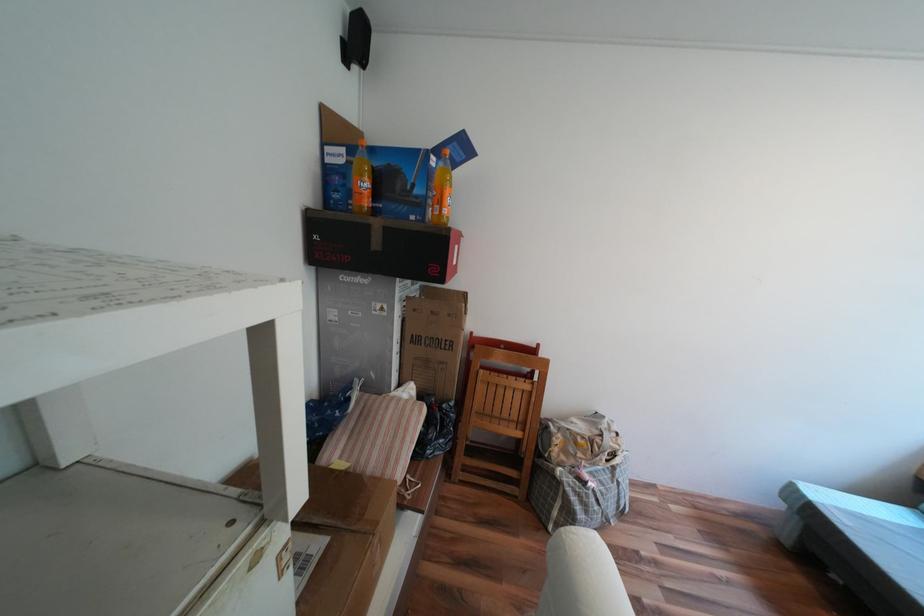
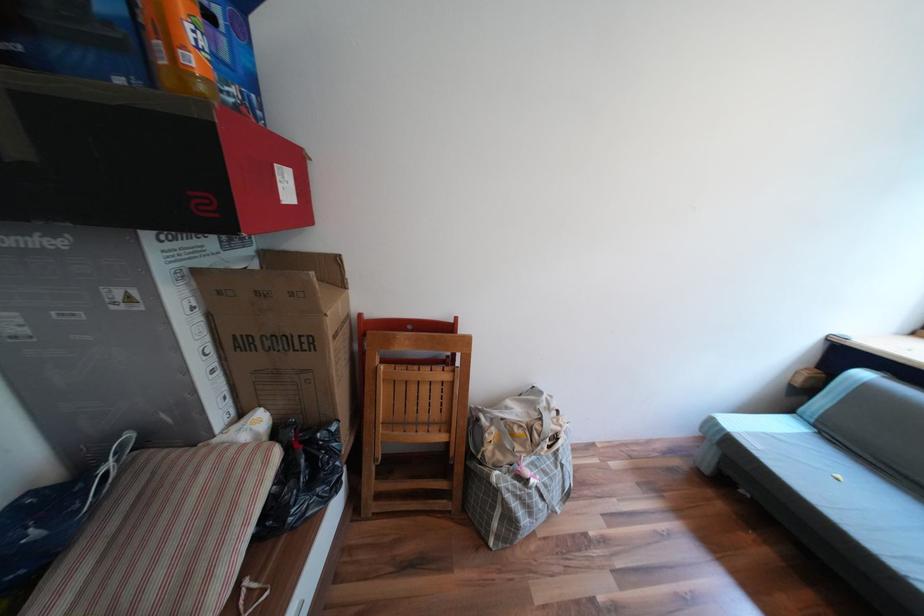
In the second image, find the point that corresponds to point (564, 439) in the first image.

(495, 435)